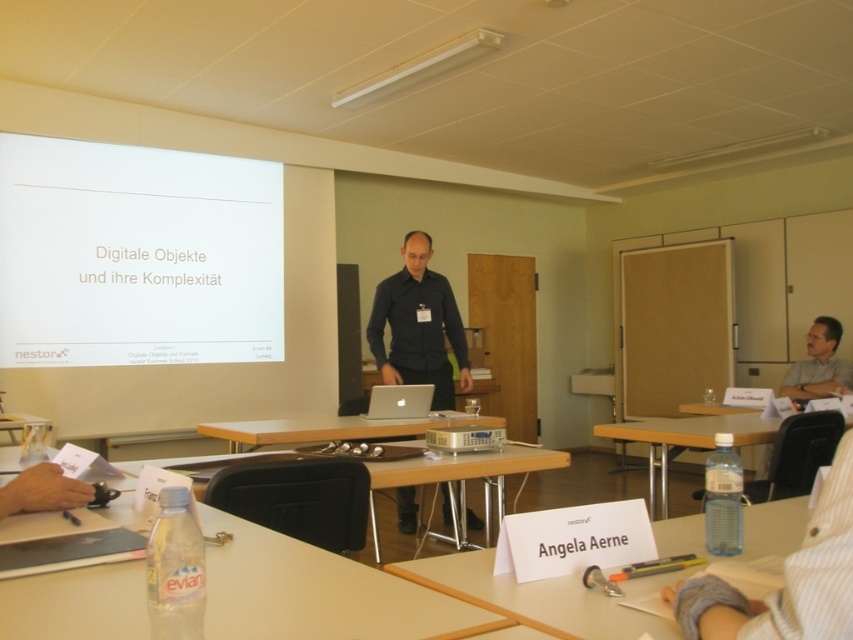
Is white paper at lower right to the left of wooden table at center from the viewer's perspective?

In fact, white paper at lower right is to the right of wooden table at center.

Is white paper at lower right positioned before wooden table at center?

Yes, it is in front of wooden table at center.

What do you see at coordinates (786, 579) in the screenshot? This screenshot has height=640, width=853. I see `white paper at lower right` at bounding box center [786, 579].

Identify the location of white paper at lower right. (786, 579).

How far apart are clear plastic water bottle at lower left and matte gray shirt at right?

The distance of clear plastic water bottle at lower left from matte gray shirt at right is 13.13 feet.

The image size is (853, 640). What do you see at coordinates (318, 593) in the screenshot?
I see `clear plastic water bottle at lower left` at bounding box center [318, 593].

Find the location of `clear plastic water bottle at lower left`. clear plastic water bottle at lower left is located at coordinates (318, 593).

Can you confirm if white paper at center is smaller than wooden table at center?

Yes, white paper at center is smaller than wooden table at center.

From the picture: Is white paper at center positioned before wooden table at center?

Yes, white paper at center is in front of wooden table at center.

Is point (433, 573) less distant than point (286, 433)?

Yes, point (433, 573) is in front of point (286, 433).

Locate an element on the screen. This screenshot has height=640, width=853. white paper at center is located at coordinates (531, 598).